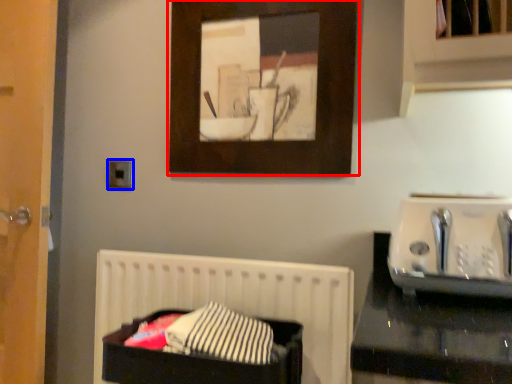
Question: Among these objects, which one is nearest to the camera, picture frame (highlighted by a red box) or electric outlet (highlighted by a blue box)?

Choices:
 (A) picture frame
 (B) electric outlet

Answer: (A)